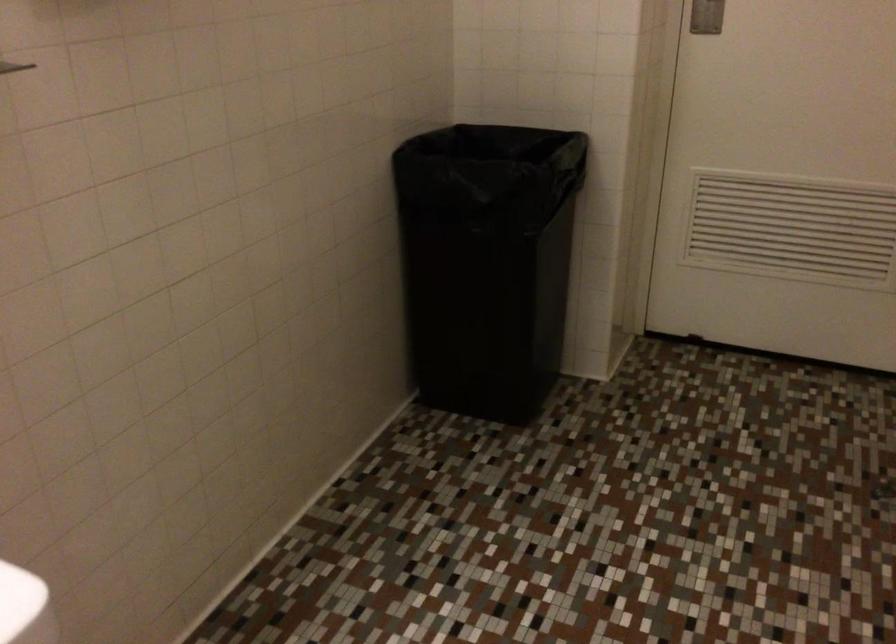
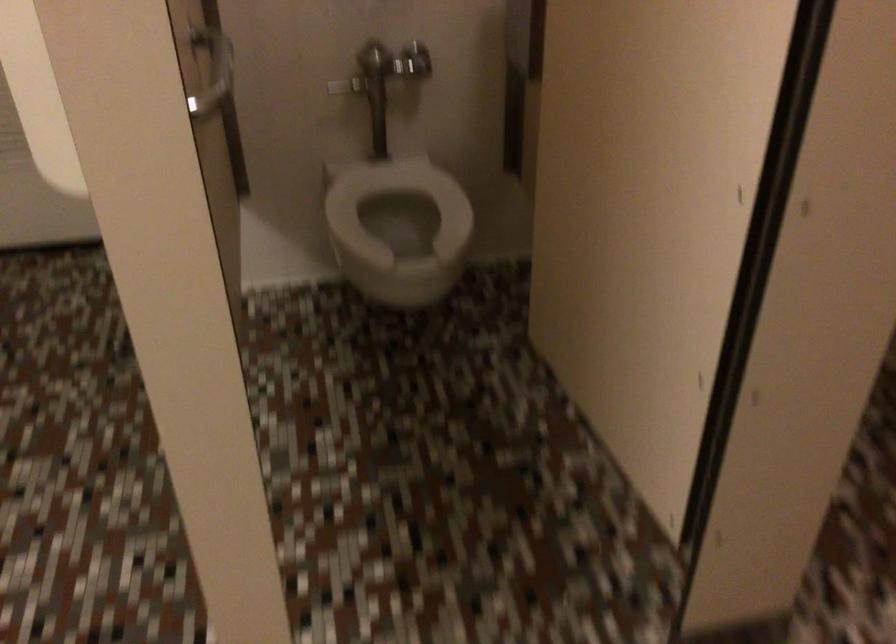
Question: The camera is either moving clockwise (left) or counter-clockwise (right) around the object. The first image is from the beginning of the video and the second image is from the end. Is the camera moving left or right when shooting the video?

Choices:
 (A) Left
 (B) Right

Answer: (A)